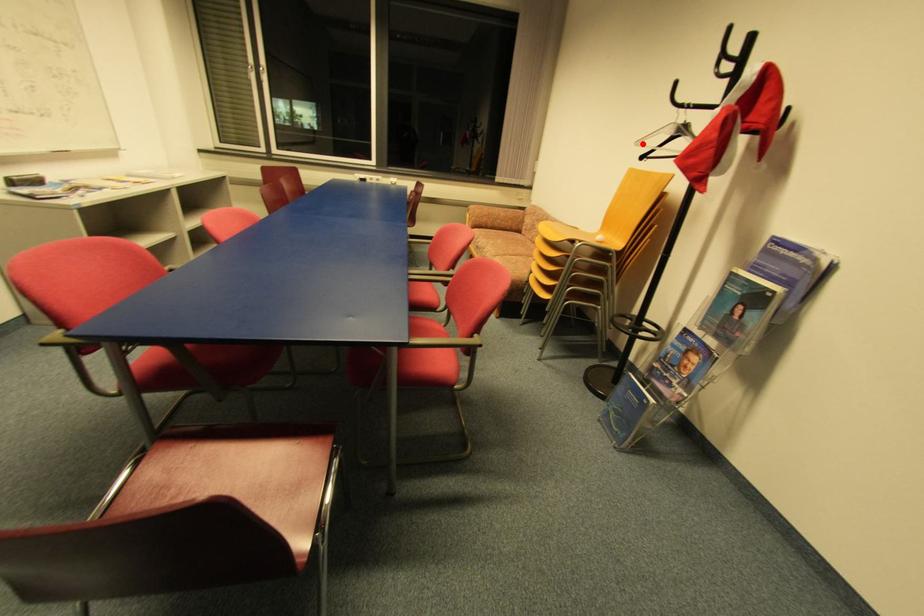
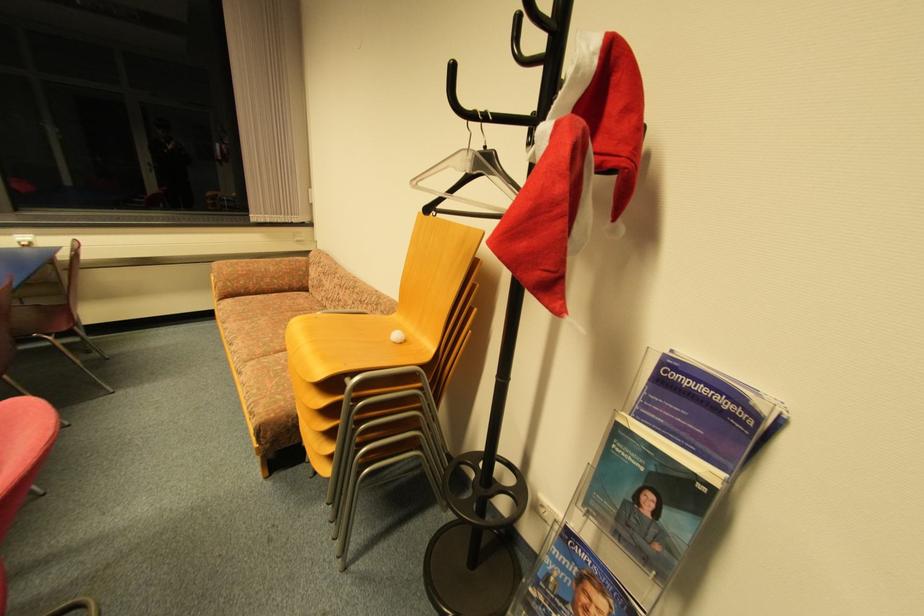
In the second image, find the point that corresponds to the highlighted location in the first image.

(419, 184)